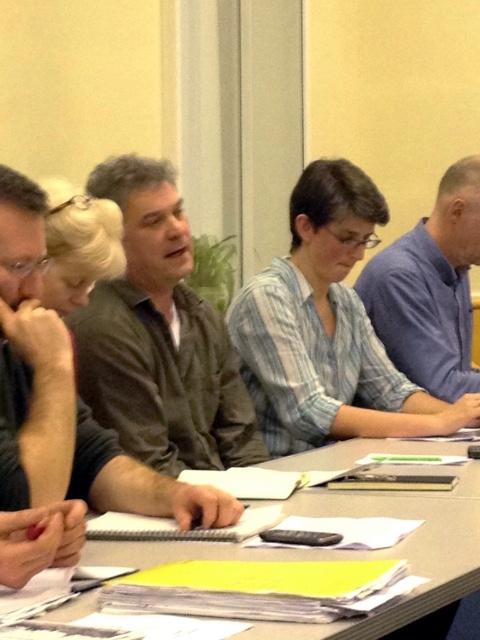
Question: Is dark brown shirt at center to the right of smooth gray table at center from the viewer's perspective?

Choices:
 (A) no
 (B) yes

Answer: (A)

Question: Is smooth gray table at center above blue shirt at right?

Choices:
 (A) yes
 (B) no

Answer: (B)

Question: Which object is farther from the camera taking this photo?

Choices:
 (A) smooth gray table at center
 (B) blue shirt at right
 (C) dark brown shirt at center

Answer: (B)

Question: Does smooth gray table at center appear on the left side of blue shirt at right?

Choices:
 (A) yes
 (B) no

Answer: (A)

Question: Which object is farther from the camera taking this photo?

Choices:
 (A) dark brown shirt at center
 (B) blue shirt at right

Answer: (B)

Question: Which is farther from the dark brown shirt at center?

Choices:
 (A) smooth gray table at center
 (B) blue shirt at right

Answer: (B)